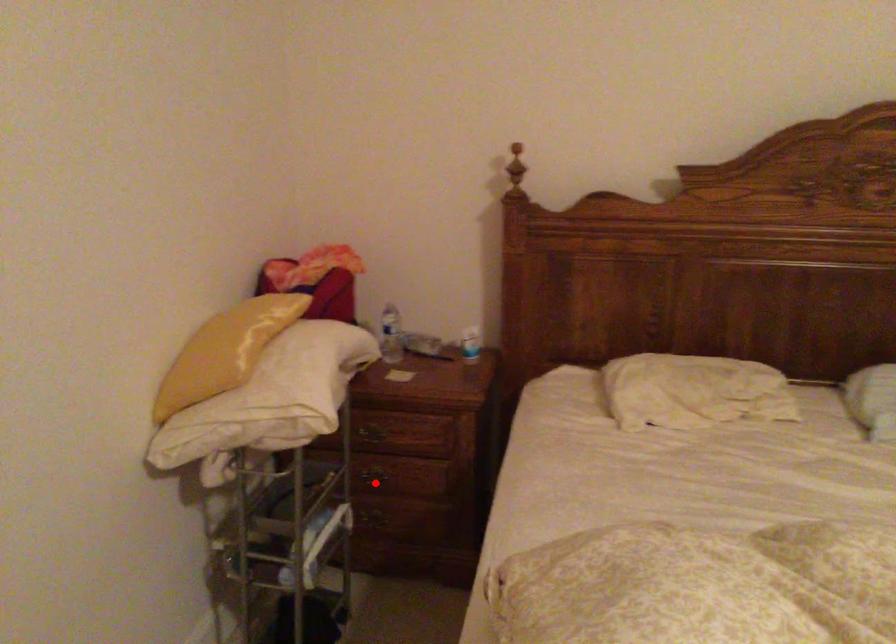
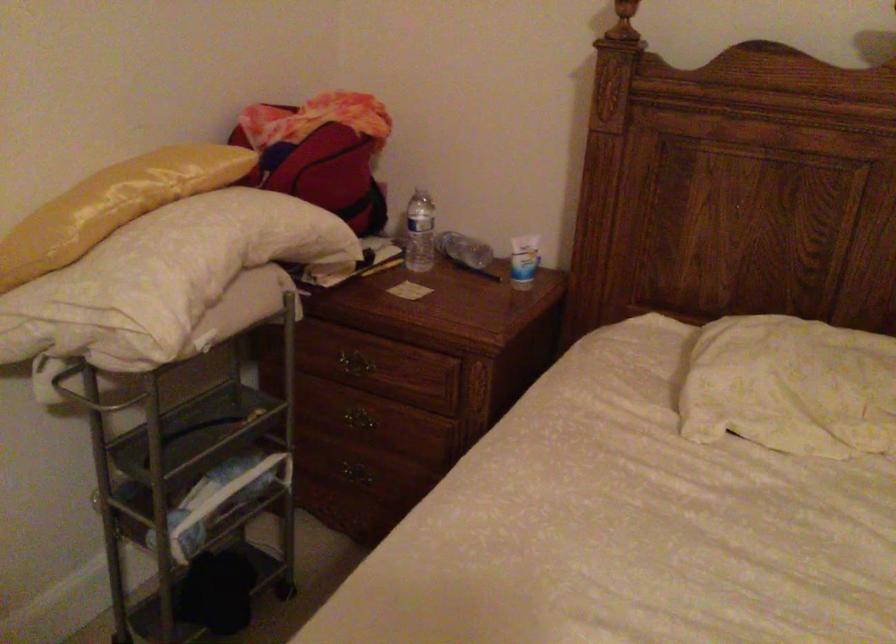
Question: I am providing you with two images of the same scene from different viewpoints. In image1, a red point is highlighted. Considering the same 3D point in image2, which of the following is correct?

Choices:
 (A) It is closer
 (B) It is farther

Answer: (A)